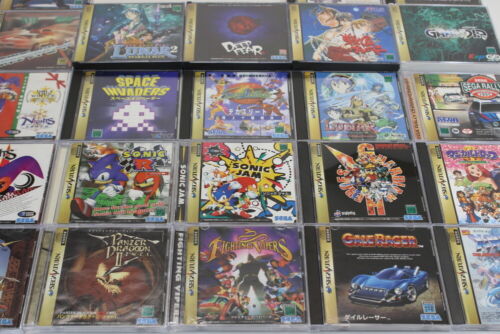
Identify the location of top row of games. (436, 42), (355, 33), (252, 36), (156, 39), (45, 37).